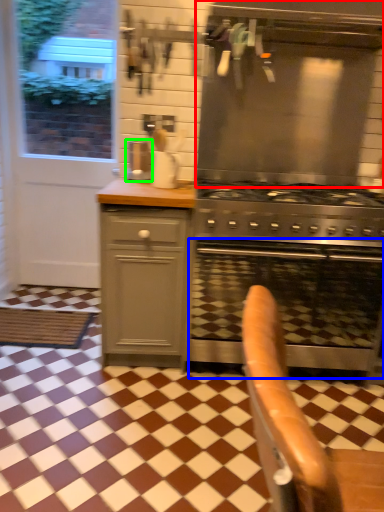
Question: Which object is the closest to the vent (highlighted by a red box)? Choose among these: oven (highlighted by a blue box) or coffee machine (highlighted by a green box).

Choices:
 (A) oven
 (B) coffee machine

Answer: (B)